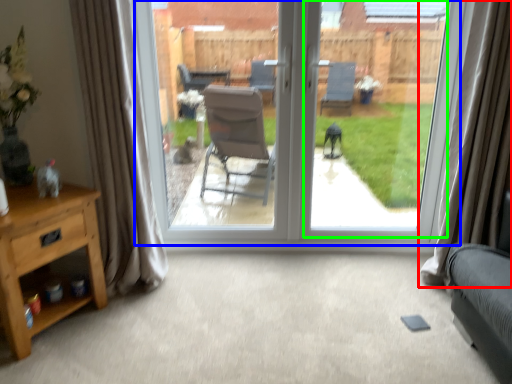
Question: Considering the real-world distances, which object is closest to curtain (highlighted by a red box)? window (highlighted by a blue box) or window screen (highlighted by a green box).

Choices:
 (A) window
 (B) window screen

Answer: (A)